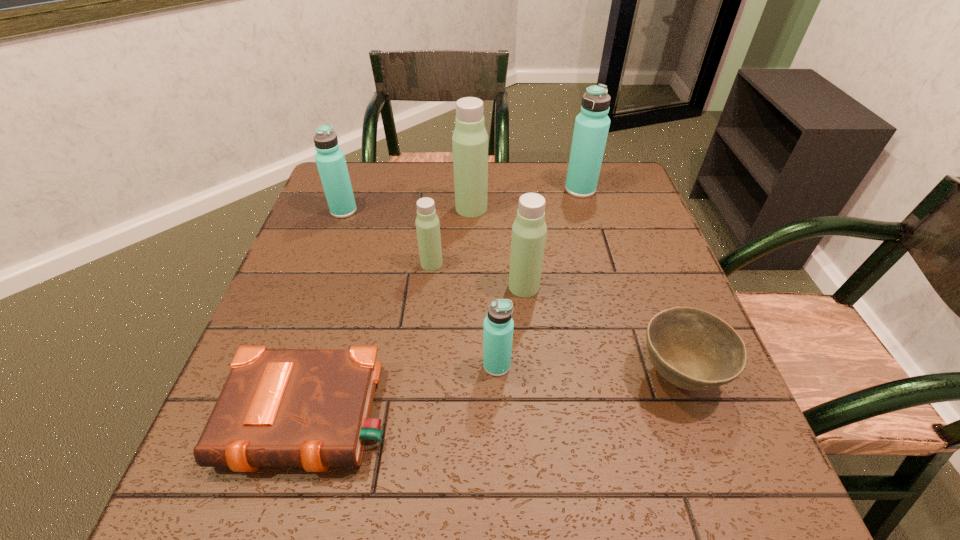
Locate an element on the screen. light thermos bottle that stands as the second closest to the Bible is located at coordinates (529, 229).

At what (x,y) coordinates should I click in order to perform the action: click on free location that satisfies the following two spatial constraints: 1. on the back side of the farthest light thermos bottle; 2. on the right side of the second farthest aqua thermos bottle. Please return your answer as a coordinate pair (x, y). Looking at the image, I should click on (345, 208).